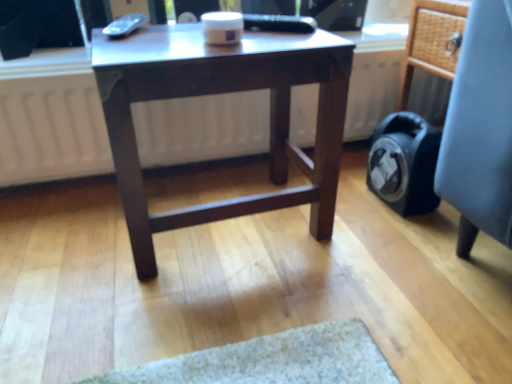
Question: Based on their positions, is light blue fabric chair at right located to the left or right of dark brown wood table at center?

Choices:
 (A) left
 (B) right

Answer: (B)

Question: Is light blue fabric chair at right spatially inside dark brown wood table at center, or outside of it?

Choices:
 (A) inside
 (B) outside

Answer: (B)

Question: Is light blue fabric chair at right in front of or behind dark brown wood table at center in the image?

Choices:
 (A) behind
 (B) front

Answer: (A)

Question: Based on their sizes in the image, would you say dark brown wood table at center is bigger or smaller than light blue fabric chair at right?

Choices:
 (A) big
 (B) small

Answer: (A)

Question: In the image, is dark brown wood table at center positioned in front of or behind light blue fabric chair at right?

Choices:
 (A) behind
 (B) front

Answer: (B)

Question: Which is correct: dark brown wood table at center is inside light blue fabric chair at right, or outside of it?

Choices:
 (A) outside
 (B) inside

Answer: (A)

Question: Looking at their shapes, would you say dark brown wood table at center is wider or thinner than light blue fabric chair at right?

Choices:
 (A) thin
 (B) wide

Answer: (A)